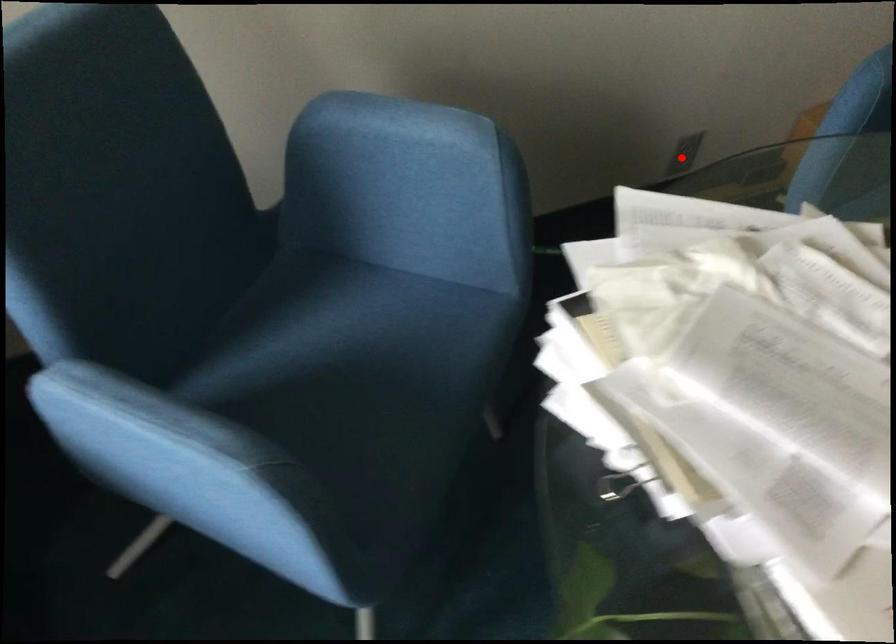
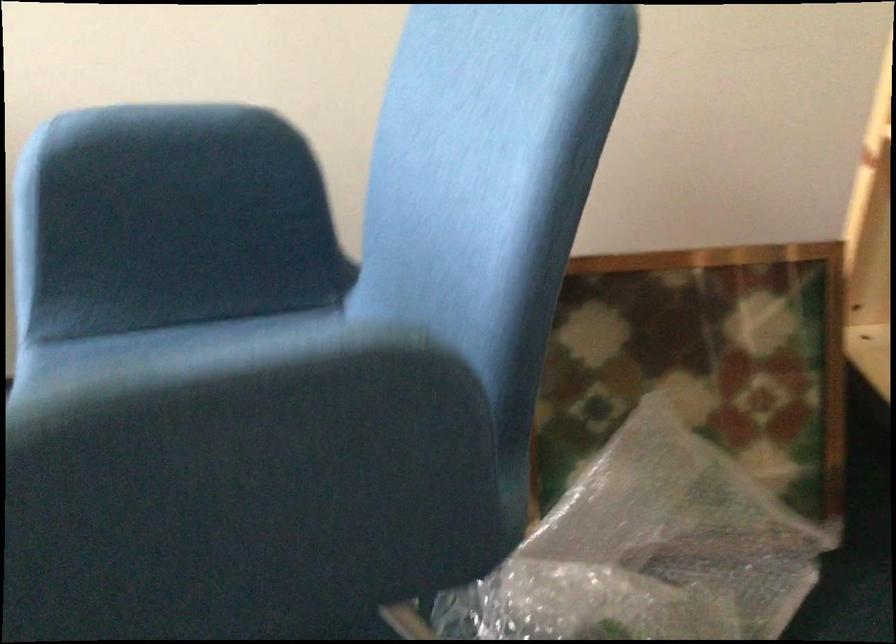
Question: I am providing you with two images of the same scene from different viewpoints. A red point is marked on the first image. Is the red point's position out of view in image 2?

Choices:
 (A) Yes
 (B) No

Answer: (A)